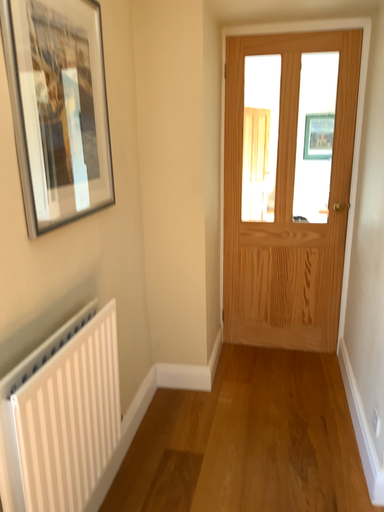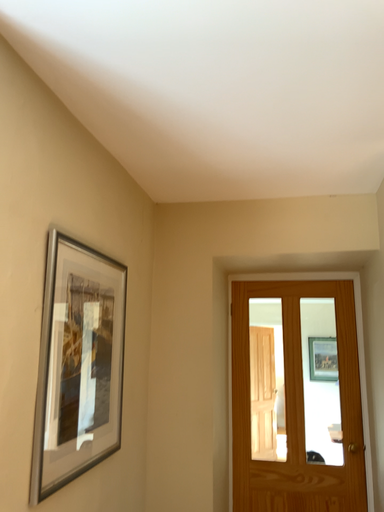
Question: Which way did the camera rotate in the video?

Choices:
 (A) rotated downward
 (B) rotated upward

Answer: (B)